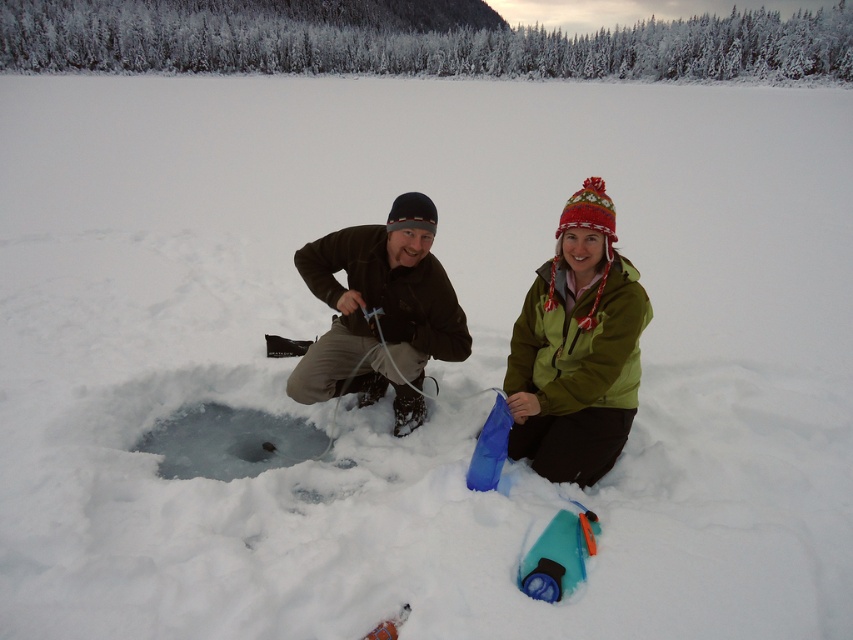
Between point (614, 326) and point (235, 474), which one is positioned behind?

Point (235, 474)

How distant is green fuzzy jacket at lower right from transparent ice hole at center?

A distance of 1.54 meters exists between green fuzzy jacket at lower right and transparent ice hole at center.

Is point (517, 342) positioned after point (326, 436)?

That is False.

The height and width of the screenshot is (640, 853). I want to click on green fuzzy jacket at lower right, so click(x=577, y=348).

Does dark brown fabric jacket at center have a lesser width compared to transparent ice hole at center?

Yes.

Between point (424, 291) and point (194, 422), which one is positioned in front?

Point (424, 291)

The image size is (853, 640). I want to click on dark brown fabric jacket at center, so click(x=381, y=310).

Can you confirm if dark brown jacket at center is smaller than transparent ice hole at center?

Actually, dark brown jacket at center might be larger than transparent ice hole at center.

Between dark brown jacket at center and transparent ice hole at center, which one is positioned higher?

dark brown jacket at center is above.

Where is `dark brown jacket at center`? This screenshot has width=853, height=640. dark brown jacket at center is located at coordinates (577, 349).

Where is `dark brown jacket at center`? The width and height of the screenshot is (853, 640). dark brown jacket at center is located at coordinates (577, 349).